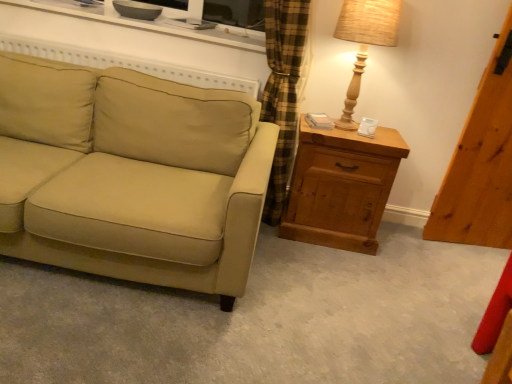
Question: Is beige fabric couch at left surrounded by wooden table lamp at right?

Choices:
 (A) no
 (B) yes

Answer: (A)

Question: Can you confirm if wooden table lamp at right is thinner than beige fabric couch at left?

Choices:
 (A) yes
 (B) no

Answer: (A)

Question: From a real-world perspective, is wooden table lamp at right positioned over beige fabric couch at left based on gravity?

Choices:
 (A) yes
 (B) no

Answer: (A)

Question: Would you say wooden table lamp at right is a long distance from beige fabric couch at left?

Choices:
 (A) yes
 (B) no

Answer: (B)

Question: Does wooden table lamp at right appear on the right side of beige fabric couch at left?

Choices:
 (A) yes
 (B) no

Answer: (A)

Question: From the image's perspective, would you say wooden table lamp at right is shown under beige fabric couch at left?

Choices:
 (A) no
 (B) yes

Answer: (A)

Question: Is beige fabric couch at left facing towards wooden table lamp at right?

Choices:
 (A) yes
 (B) no

Answer: (B)

Question: Can you see beige fabric couch at left touching wooden table lamp at right?

Choices:
 (A) no
 (B) yes

Answer: (A)

Question: Considering the relative sizes of beige fabric couch at left and wooden table lamp at right in the image provided, is beige fabric couch at left bigger than wooden table lamp at right?

Choices:
 (A) no
 (B) yes

Answer: (B)

Question: Is there a large distance between beige fabric couch at left and wooden table lamp at right?

Choices:
 (A) yes
 (B) no

Answer: (B)

Question: Is beige fabric couch at left not inside wooden table lamp at right?

Choices:
 (A) yes
 (B) no

Answer: (A)

Question: Is the depth of beige fabric couch at left less than that of wooden table lamp at right?

Choices:
 (A) yes
 (B) no

Answer: (A)

Question: Would you say wooden chest of drawers at right is a long distance from wooden table lamp at right?

Choices:
 (A) yes
 (B) no

Answer: (B)